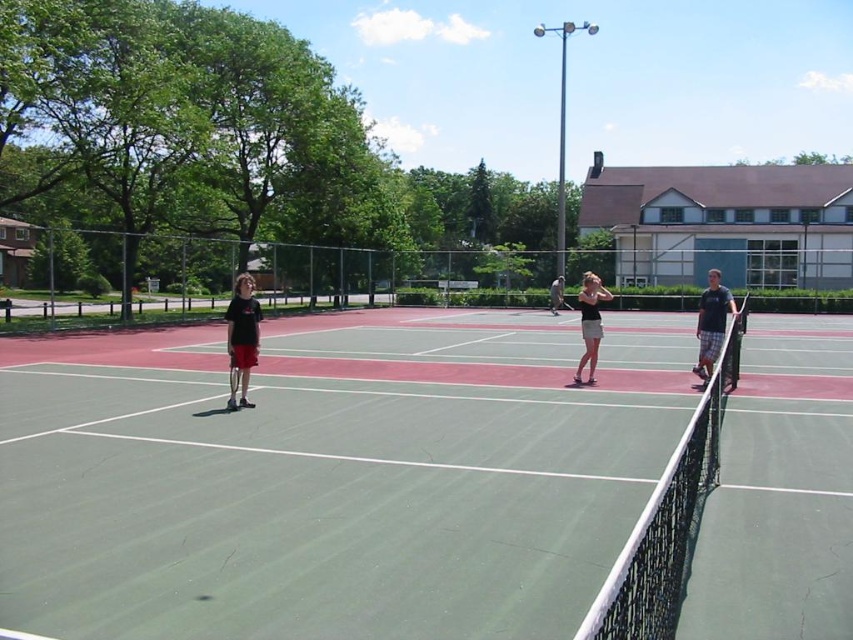
Can you confirm if white mesh net at center is smaller than matte black shorts at left?

Incorrect, white mesh net at center is not smaller in size than matte black shorts at left.

Who is lower down, white mesh net at center or matte black shorts at left?

white mesh net at center is below.

Is point (670, 584) less distant than point (247, 371)?

That is True.

This screenshot has width=853, height=640. In order to click on white mesh net at center in this screenshot , I will do `click(666, 518)`.

From the picture: Is green rubber tennis court at center bigger than matte black shirt at right?

Actually, green rubber tennis court at center might be smaller than matte black shirt at right.

The width and height of the screenshot is (853, 640). What do you see at coordinates (329, 476) in the screenshot? I see `green rubber tennis court at center` at bounding box center [329, 476].

The height and width of the screenshot is (640, 853). I want to click on green rubber tennis court at center, so click(329, 476).

Looking at this image, between matte black shorts at left and matte black tank top at center, which one is positioned higher?

matte black tank top at center

Does matte black shorts at left have a larger size compared to matte black tank top at center?

Incorrect, matte black shorts at left is not larger than matte black tank top at center.

Where is `matte black shorts at left`? The width and height of the screenshot is (853, 640). matte black shorts at left is located at coordinates (242, 332).

At what (x,y) coordinates should I click in order to perform the action: click on matte black shorts at left. Please return your answer as a coordinate pair (x, y). Looking at the image, I should click on (242, 332).